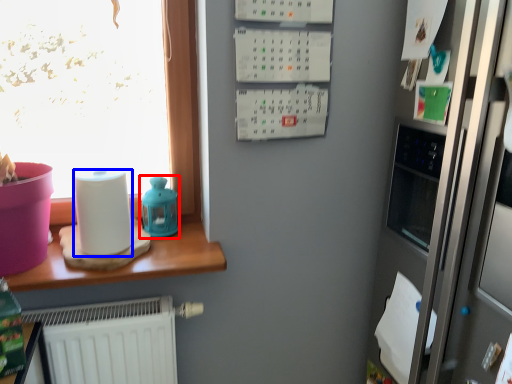
Question: Among these objects, which one is farthest to the camera, appliance (highlighted by a red box) or paper towel (highlighted by a blue box)?

Choices:
 (A) appliance
 (B) paper towel

Answer: (A)